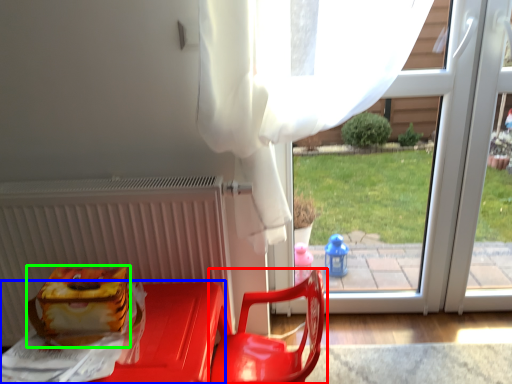
Question: Which is nearer to the chair (highlighted by a red box)? furniture (highlighted by a blue box) or lunch box (highlighted by a green box).

Choices:
 (A) furniture
 (B) lunch box

Answer: (A)